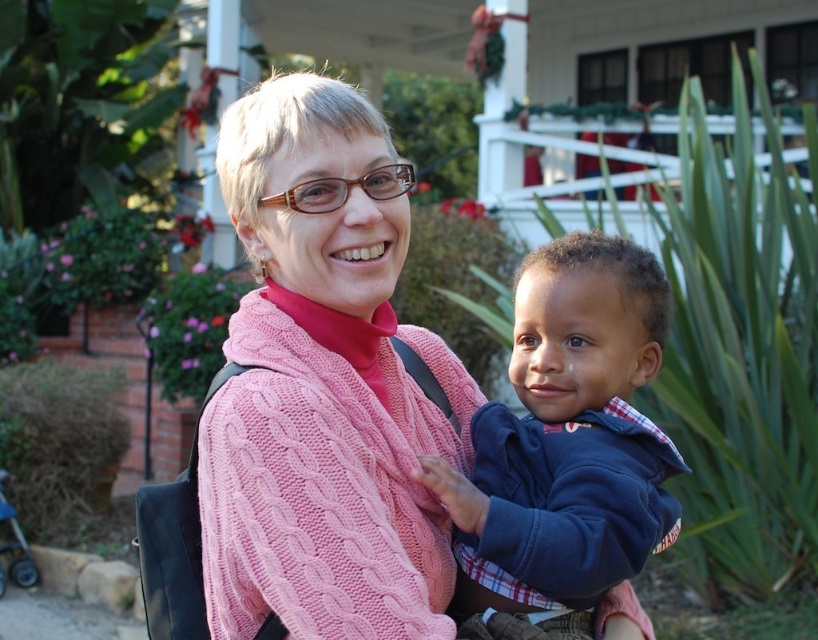
Which is more to the right, cable-knit pink shawl at center or blue fleece jacket at center?

blue fleece jacket at center

Measure the distance between point (227, 435) and camera.

Point (227, 435) is 8.42 feet away from camera.

Describe the element at coordinates (326, 486) in the screenshot. I see `cable-knit pink shawl at center` at that location.

Image resolution: width=818 pixels, height=640 pixels. What are the coordinates of `cable-knit pink shawl at center` in the screenshot? It's located at (326, 486).

Is pink knitted sweater at center shorter than cable-knit pink shawl at center?

No.

You are a GUI agent. You are given a task and a screenshot of the screen. Output one action in this format:
    pyautogui.click(x=<x>, y=<y>)
    Task: Click on the pink knitted sweater at center
    The width and height of the screenshot is (818, 640).
    Given the screenshot: What is the action you would take?
    pyautogui.click(x=322, y=385)

Is point (245, 394) positioned behind point (556, 614)?

No.

Locate an element on the screen. The width and height of the screenshot is (818, 640). pink knitted sweater at center is located at coordinates (322, 385).

In order to click on pink knitted sweater at center in this screenshot , I will do `click(322, 385)`.

Find the location of a particular element. This screenshot has width=818, height=640. pink knitted sweater at center is located at coordinates (322, 385).